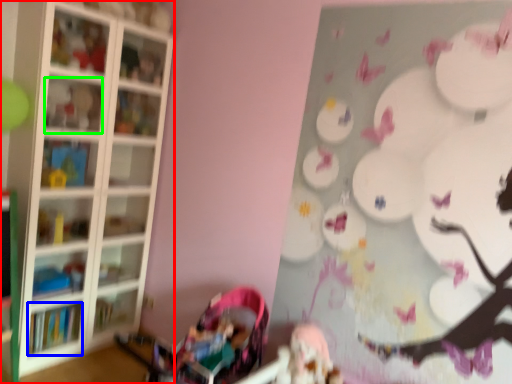
Question: Based on their relative distances, which object is nearer to shelf (highlighted by a red box)? Choose from book (highlighted by a blue box) and shelf (highlighted by a green box).

Choices:
 (A) book
 (B) shelf

Answer: (B)